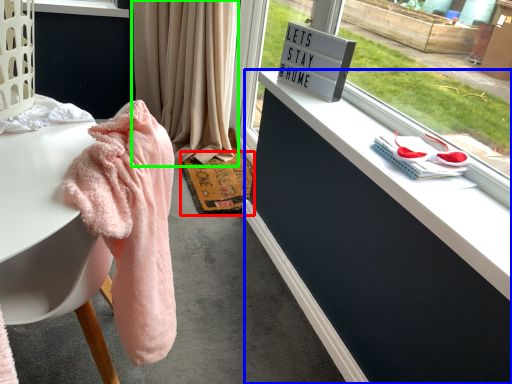
Question: Which object is positioned farthest from mat (highlighted by a red box)? Select from dresser (highlighted by a blue box) and curtain (highlighted by a green box).

Choices:
 (A) dresser
 (B) curtain

Answer: (A)